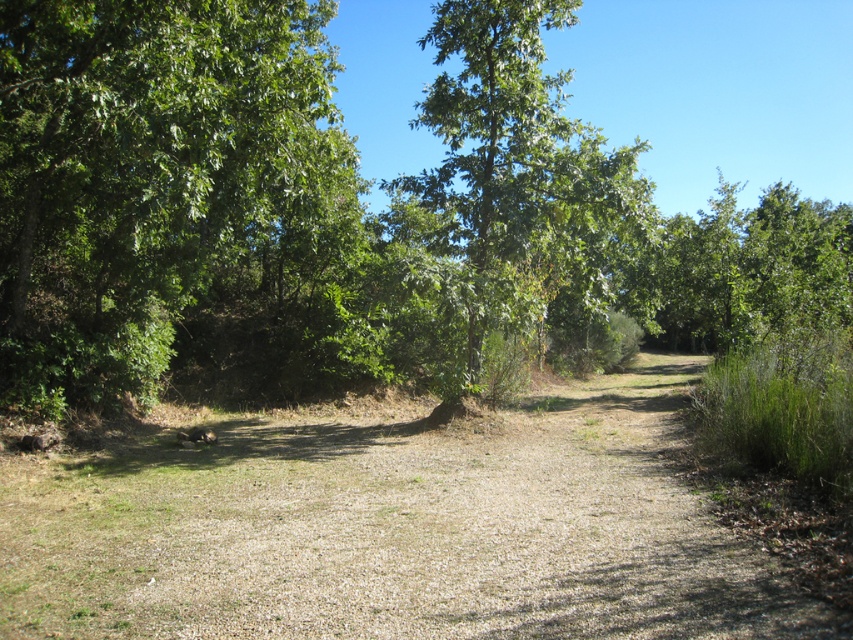
Question: Among these objects, which one is farthest from the camera?

Choices:
 (A) green leafy forest at center
 (B) green leafy tree at left
 (C) green leafy tree at center

Answer: (C)

Question: Is green leafy forest at center to the right of green leafy tree at left from the viewer's perspective?

Choices:
 (A) no
 (B) yes

Answer: (B)

Question: From the image, what is the correct spatial relationship of green leafy tree at left in relation to green leafy tree at center?

Choices:
 (A) above
 (B) below

Answer: (B)

Question: Considering the real-world distances, which object is closest to the green leafy tree at left?

Choices:
 (A) green leafy forest at center
 (B) green leafy tree at center

Answer: (A)

Question: Estimate the real-world distances between objects in this image. Which object is farther from the green leafy tree at left?

Choices:
 (A) green leafy forest at center
 (B) green leafy tree at center

Answer: (B)

Question: Observing the image, what is the correct spatial positioning of green leafy forest at center in reference to green leafy tree at left?

Choices:
 (A) left
 (B) right

Answer: (B)